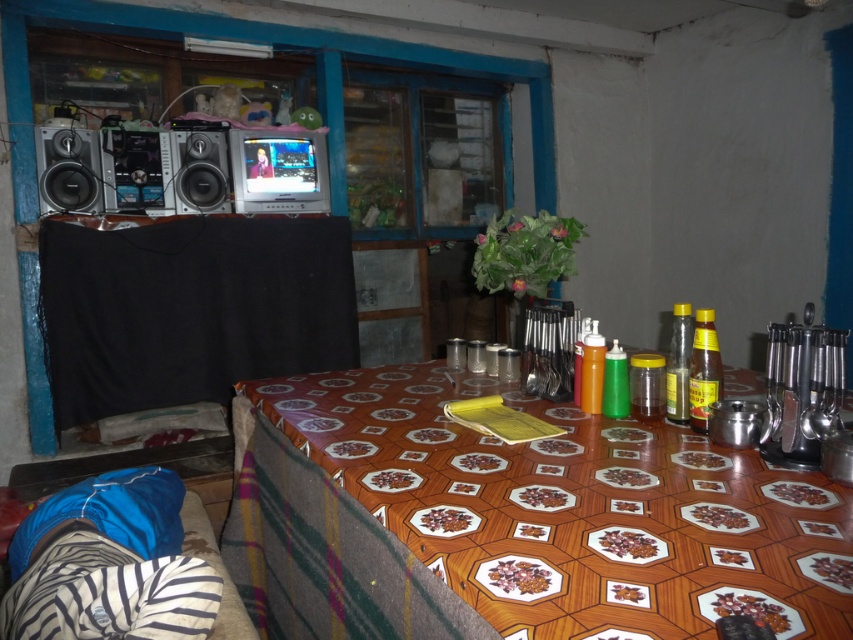
Between black fabric at left and matte black speaker at left, which one appears on the left side from the viewer's perspective?

From the viewer's perspective, matte black speaker at left appears more on the left side.

Is black fabric at left shorter than matte black speaker at left?

Incorrect, black fabric at left's height does not fall short of matte black speaker at left's.

Find the location of `black fabric at left`. black fabric at left is located at coordinates (190, 308).

You are a GUI agent. You are given a task and a screenshot of the screen. Output one action in this format:
    pyautogui.click(x=<x>, y=<y>)
    Task: Click on the black fabric at left
    This screenshot has height=640, width=853.
    Given the screenshot: What is the action you would take?
    pyautogui.click(x=190, y=308)

Between matte black speaker at left and satin silver speaker at upper left, which one is positioned higher?

Positioned higher is satin silver speaker at upper left.

This screenshot has height=640, width=853. What do you see at coordinates (68, 170) in the screenshot?
I see `matte black speaker at left` at bounding box center [68, 170].

Locate an element on the screen. matte black speaker at left is located at coordinates (68, 170).

Is wooden table at center above black fabric at left?

Incorrect, wooden table at center is not positioned above black fabric at left.

Does wooden table at center appear on the right side of black fabric at left?

Indeed, wooden table at center is positioned on the right side of black fabric at left.

This screenshot has width=853, height=640. Describe the element at coordinates (576, 509) in the screenshot. I see `wooden table at center` at that location.

Where is `wooden table at center`? This screenshot has width=853, height=640. wooden table at center is located at coordinates (576, 509).